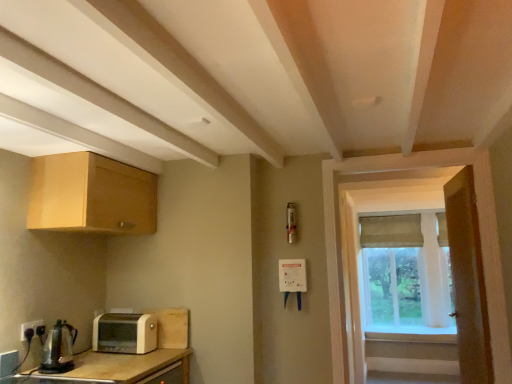
Question: Considering the relative sizes of green fabric curtain at right and black plastic electrical outlet at lower left in the image provided, is green fabric curtain at right smaller than black plastic electrical outlet at lower left?

Choices:
 (A) no
 (B) yes

Answer: (A)

Question: Considering the relative sizes of green fabric curtain at right and black plastic electrical outlet at lower left in the image provided, is green fabric curtain at right thinner than black plastic electrical outlet at lower left?

Choices:
 (A) yes
 (B) no

Answer: (B)

Question: Is the depth of green fabric curtain at right less than that of black plastic electrical outlet at lower left?

Choices:
 (A) yes
 (B) no

Answer: (B)

Question: Is green fabric curtain at right at the right side of black plastic electrical outlet at lower left?

Choices:
 (A) yes
 (B) no

Answer: (A)

Question: Is green fabric curtain at right at the left side of black plastic electrical outlet at lower left?

Choices:
 (A) no
 (B) yes

Answer: (A)

Question: Is there a large distance between green fabric curtain at right and black plastic electrical outlet at lower left?

Choices:
 (A) yes
 (B) no

Answer: (A)

Question: Could you tell me if white plastic toaster at lower left is facing wooden door at right?

Choices:
 (A) yes
 (B) no

Answer: (B)

Question: From a real-world perspective, is white plastic toaster at lower left located higher than wooden door at right?

Choices:
 (A) yes
 (B) no

Answer: (B)

Question: Is white plastic toaster at lower left to the left of wooden door at right from the viewer's perspective?

Choices:
 (A) yes
 (B) no

Answer: (A)

Question: Is white plastic toaster at lower left positioned with its back to wooden door at right?

Choices:
 (A) yes
 (B) no

Answer: (B)

Question: Is white plastic toaster at lower left positioned in front of wooden door at right?

Choices:
 (A) yes
 (B) no

Answer: (B)

Question: Would you say white plastic toaster at lower left is a long distance from wooden door at right?

Choices:
 (A) yes
 (B) no

Answer: (A)

Question: From the image's perspective, does beige fabric curtain at window appear higher than light wood cabinet at upper left?

Choices:
 (A) no
 (B) yes

Answer: (A)